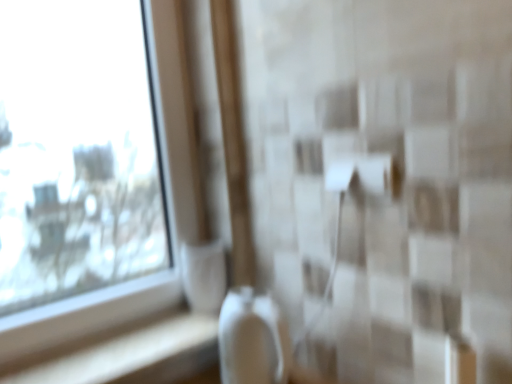
Question: Is white glossy ledge at lower left spatially inside transparent glass window at upper left, or outside of it?

Choices:
 (A) inside
 (B) outside

Answer: (B)

Question: In the image, is white glossy ledge at lower left on the left side or the right side of transparent glass window at upper left?

Choices:
 (A) left
 (B) right

Answer: (B)

Question: In terms of width, does white glossy ledge at lower left look wider or thinner when compared to transparent glass window at upper left?

Choices:
 (A) thin
 (B) wide

Answer: (B)

Question: From their relative heights in the image, would you say transparent glass window at upper left is taller or shorter than white glossy ledge at lower left?

Choices:
 (A) tall
 (B) short

Answer: (A)

Question: From a real-world perspective, is transparent glass window at upper left above or below white glossy ledge at lower left?

Choices:
 (A) below
 (B) above

Answer: (B)

Question: Does point (158, 29) appear closer or farther from the camera than point (110, 344)?

Choices:
 (A) closer
 (B) farther

Answer: (B)

Question: In the image, is transparent glass window at upper left on the left side or the right side of white glossy ledge at lower left?

Choices:
 (A) right
 (B) left

Answer: (B)